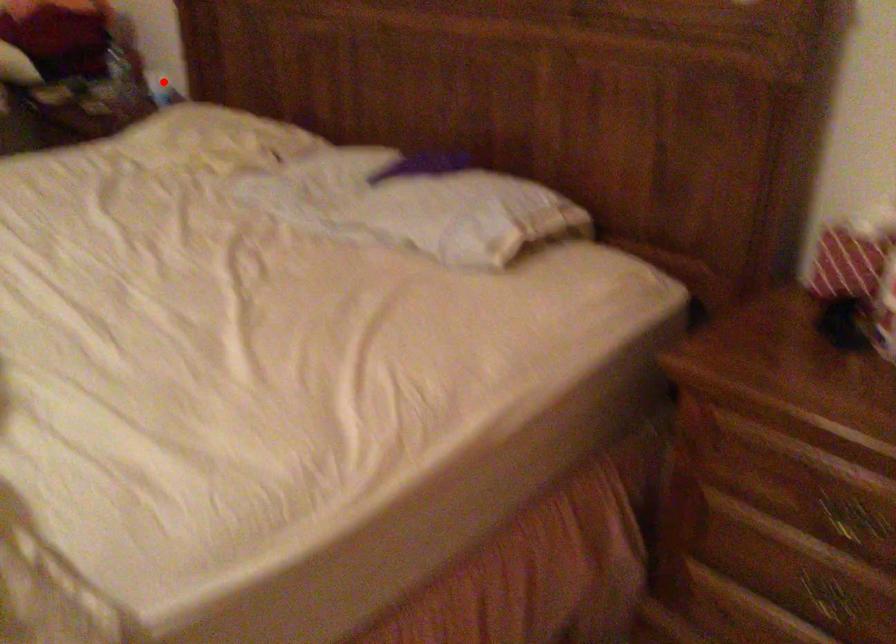
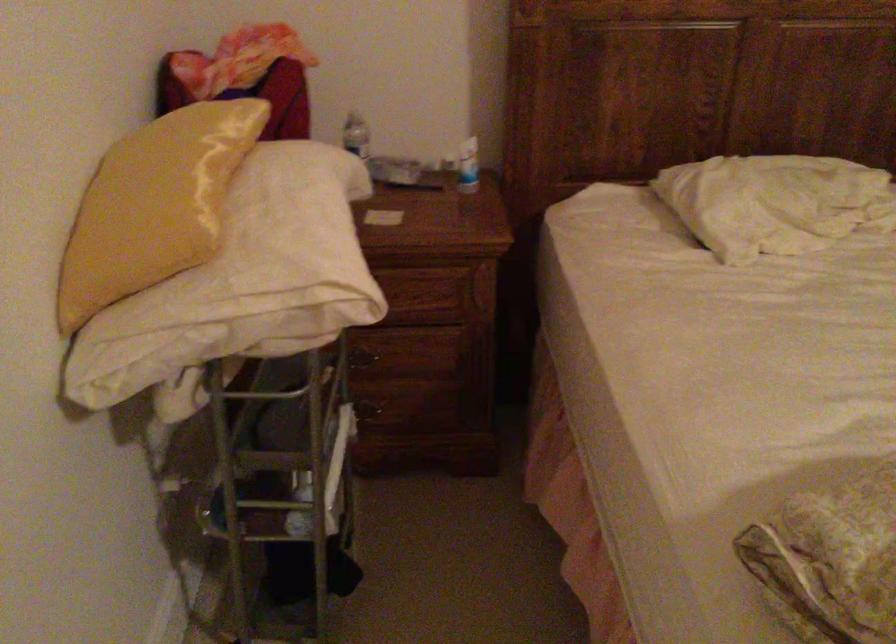
Find the pixel in the second image that matches the highlighted location in the first image.

(468, 166)